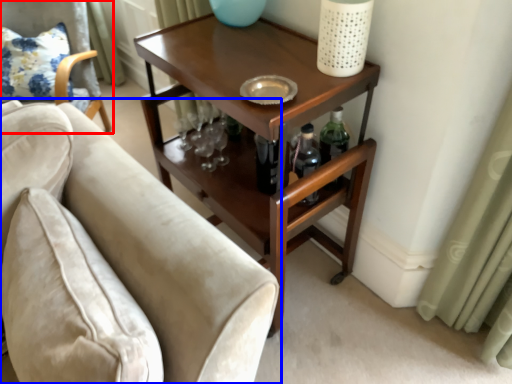
Question: Which object appears farthest to the camera in this image, chair (highlighted by a red box) or studio couch (highlighted by a blue box)?

Choices:
 (A) chair
 (B) studio couch

Answer: (A)